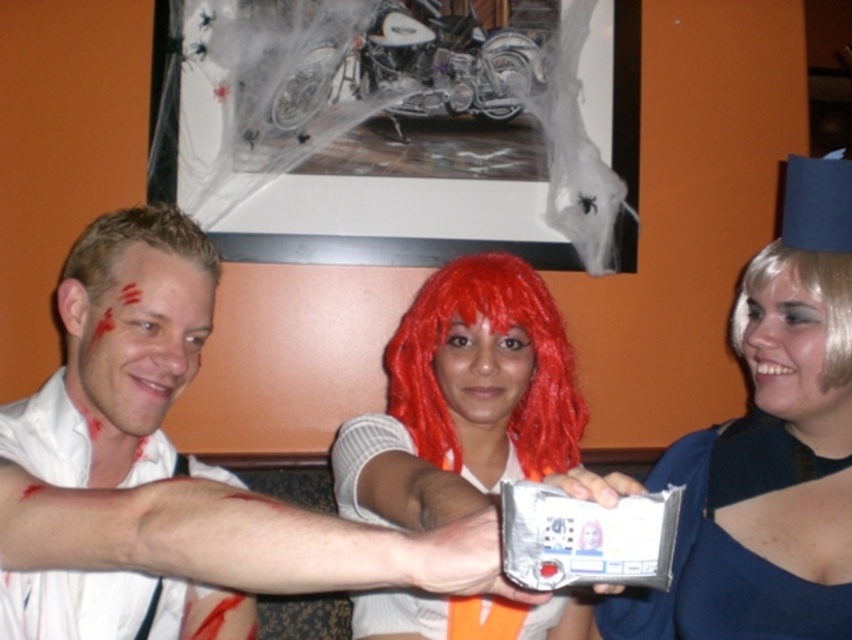
Question: Which of the following is the closest to the observer?

Choices:
 (A) blue matte dress at lower right
 (B) blonde hair at left

Answer: (B)

Question: In this image, where is blood-stained white shirt at left located relative to blonde synthetic wig at right?

Choices:
 (A) left
 (B) right

Answer: (A)

Question: Which of the following is the closest to the observer?

Choices:
 (A) shiny red wig at center
 (B) blood-stained white shirt at left

Answer: (B)

Question: Does blue fabric hat at upper right have a lesser width compared to blonde synthetic wig at right?

Choices:
 (A) no
 (B) yes

Answer: (A)

Question: Does shiny red wig at center appear on the left side of blue matte dress at lower right?

Choices:
 (A) no
 (B) yes

Answer: (B)

Question: Which point is farther to the camera?

Choices:
 (A) (492, 566)
 (B) (29, 419)
 (C) (746, 600)
 (D) (688, 595)

Answer: (D)